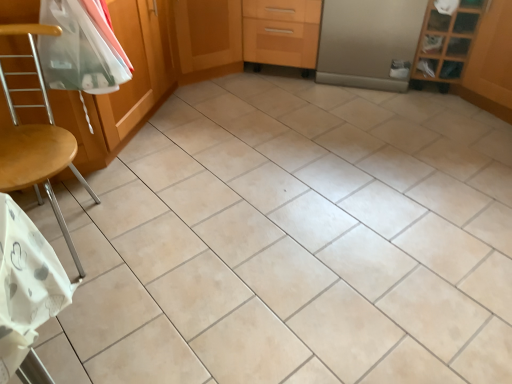
At what (x,y) coordinates should I click in order to perform the action: click on wooden shelf at upper right. Please return your answer as a coordinate pair (x, y). The image size is (512, 384). Looking at the image, I should click on (445, 44).

The image size is (512, 384). Describe the element at coordinates (36, 139) in the screenshot. I see `wooden at left` at that location.

The width and height of the screenshot is (512, 384). I want to click on wooden shelf at upper right, so click(445, 44).

Which of these two, wooden shelf at upper right or wooden cabinet at center, which is the 1th screen door from left to right, is bigger?

With larger size is wooden cabinet at center, which is the 1th screen door from left to right.

Which is nearer, (x=437, y=79) or (x=195, y=12)?

Positioned in front is point (x=195, y=12).

Locate an element on the screen. shelf that appears on the right of wooden cabinet at center, which is the 1th screen door from left to right is located at coordinates (445, 44).

Is wooden shelf at upper right looking in the opposite direction of wooden cabinet at center, which is the 2th screen door from right to left?

No, wooden shelf at upper right is not facing away from wooden cabinet at center, which is the 2th screen door from right to left.

Is wooden cabinet at center, which is the 1th screen door from left to right, positioned before wooden drawer at center?

Yes, wooden cabinet at center, which is the 1th screen door from left to right, is closer to the viewer.

Is wooden cabinet at center, which is the 2th screen door from right to left, with wooden drawer at center?

No, wooden cabinet at center, which is the 2th screen door from right to left, is not touching wooden drawer at center.

From the image's perspective, is wooden cabinet at center, which is the 2th screen door from right to left, located above or below wooden drawer at center?

Clearly, from the image's perspective, wooden cabinet at center, which is the 2th screen door from right to left, is above wooden drawer at center.

Between point (233, 31) and point (250, 39), which one is positioned behind?

The point (250, 39) is behind.

Is wooden cabinet at center, which is the 2th screen door from right to left, not inside satin silver refrigerator at center, which appears as the 2th screen door when viewed from the left?

Absolutely, wooden cabinet at center, which is the 2th screen door from right to left, is external to satin silver refrigerator at center, which appears as the 2th screen door when viewed from the left.

From a real-world perspective, does wooden cabinet at center, which is the 1th screen door from left to right, sit lower than satin silver refrigerator at center, which appears as the 2th screen door when viewed from the left?

Correct, in the physical world, wooden cabinet at center, which is the 1th screen door from left to right, is lower than satin silver refrigerator at center, which appears as the 2th screen door when viewed from the left.

Does point (185, 82) appear closer or farther from the camera than point (399, 15)?

Point (185, 82).

Are wooden cabinet at center, which is the 1th screen door from left to right, and satin silver refrigerator at center, which appears as the 2th screen door when viewed from the left, beside each other?

wooden cabinet at center, which is the 1th screen door from left to right, is not next to satin silver refrigerator at center, which appears as the 2th screen door when viewed from the left, and they're not touching.

Based on the photo, from the image's perspective, is wooden drawer at center located above or below clear plastic bag at upper left?

Clearly, from the image's perspective, wooden drawer at center is above clear plastic bag at upper left.

Is wooden drawer at center not within clear plastic bag at upper left?

Yes.

What's the angular difference between wooden drawer at center and clear plastic bag at upper left's facing directions?

The angle between the facing direction of wooden drawer at center and the facing direction of clear plastic bag at upper left is 90.3 degrees.

Which is behind, wooden drawer at center or clear plastic bag at upper left?

wooden drawer at center is behind.

Considering the sizes of clear plastic bag at upper left and wooden cabinet at center, which is the 2th screen door from right to left, in the image, is clear plastic bag at upper left bigger or smaller than wooden cabinet at center, which is the 2th screen door from right to left,?

Considering their sizes, clear plastic bag at upper left takes up less space than wooden cabinet at center, which is the 2th screen door from right to left.

Does clear plastic bag at upper left turn towards wooden cabinet at center, which is the 2th screen door from right to left?

No, clear plastic bag at upper left is not facing towards wooden cabinet at center, which is the 2th screen door from right to left.

From a real-world perspective, is clear plastic bag at upper left located beneath wooden cabinet at center, which is the 2th screen door from right to left?

Actually, clear plastic bag at upper left is physically above wooden cabinet at center, which is the 2th screen door from right to left, in the real world.

Find the location of a particular element. material located below the wooden cabinet at center, which is the 1th screen door from left to right (from the image's perspective) is located at coordinates (81, 48).

Which object is thinner, clear plastic bag at upper left or satin silver refrigerator at center, which appears as the 2th screen door when viewed from the left?

With smaller width is clear plastic bag at upper left.

Who is taller, clear plastic bag at upper left or satin silver refrigerator at center, the 1th screen door positioned from the right?

satin silver refrigerator at center, the 1th screen door positioned from the right, is taller.

From the image's perspective, is clear plastic bag at upper left beneath satin silver refrigerator at center, the 1th screen door positioned from the right?

Yes, from the image's perspective, clear plastic bag at upper left is beneath satin silver refrigerator at center, the 1th screen door positioned from the right.

Would you say clear plastic bag at upper left contains satin silver refrigerator at center, the 1th screen door positioned from the right?

No, clear plastic bag at upper left does not contain satin silver refrigerator at center, the 1th screen door positioned from the right.

Relative to wooden at left, is wooden cabinet at center, which is the 2th screen door from right to left, in front or behind?

In the image, wooden cabinet at center, which is the 2th screen door from right to left, appears behind wooden at left.

Looking at the image, does wooden cabinet at center, which is the 1th screen door from left to right, seem bigger or smaller compared to wooden at left?

Clearly, wooden cabinet at center, which is the 1th screen door from left to right, is larger in size than wooden at left.

From the image's perspective, is wooden cabinet at center, which is the 2th screen door from right to left, beneath wooden at left?

No, from the image's perspective, wooden cabinet at center, which is the 2th screen door from right to left, is not below wooden at left.

Is wooden cabinet at center, which is the 1th screen door from left to right, not within wooden at left?

Yes, wooden cabinet at center, which is the 1th screen door from left to right, is outside of wooden at left.

Where is `shelf lying in front of the wooden cabinet at center, which is the 1th screen door from left to right`? This screenshot has width=512, height=384. shelf lying in front of the wooden cabinet at center, which is the 1th screen door from left to right is located at coordinates (445, 44).

You are a GUI agent. You are given a task and a screenshot of the screen. Output one action in this format:
    pyautogui.click(x=<x>, y=<y>)
    Task: Click on the screen door above the wooden drawer at center (from the image's perspective)
    The width and height of the screenshot is (512, 384).
    Given the screenshot: What is the action you would take?
    pyautogui.click(x=208, y=38)

Looking at this image, which object lies further to the anchor point satin silver refrigerator at center, which appears as the 2th screen door when viewed from the left, wooden at left or clear plastic bag at upper left?

wooden at left is positioned further to the anchor satin silver refrigerator at center, which appears as the 2th screen door when viewed from the left.

When comparing their distances from wooden at left, does satin silver refrigerator at center, the 1th screen door positioned from the right, or wooden drawer at center seem further?

satin silver refrigerator at center, the 1th screen door positioned from the right, lies further to wooden at left than the other object.

Considering their positions, is wooden drawer at center positioned further to wooden cabinet at center, which is the 1th screen door from left to right, than wooden at left?

wooden at left is further to wooden cabinet at center, which is the 1th screen door from left to right.

Which object lies nearer to the anchor point clear plastic bag at upper left, wooden shelf at upper right or wooden at left?

wooden at left.

Which object lies nearer to the anchor point wooden shelf at upper right, wooden cabinet at center, which is the 1th screen door from left to right, or satin silver refrigerator at center, the 1th screen door positioned from the right?

The object closer to wooden shelf at upper right is satin silver refrigerator at center, the 1th screen door positioned from the right.

Based on the photo, when comparing their distances from wooden at left, does wooden shelf at upper right or wooden cabinet at center, which is the 1th screen door from left to right, seem further?

wooden shelf at upper right is further to wooden at left.

Based on their spatial positions, is clear plastic bag at upper left or wooden cabinet at center, which is the 2th screen door from right to left, closer to wooden at left?

clear plastic bag at upper left is closer to wooden at left.

Estimate the real-world distances between objects in this image. Which object is closer to satin silver refrigerator at center, which appears as the 2th screen door when viewed from the left, clear plastic bag at upper left or wooden at left?

clear plastic bag at upper left lies closer to satin silver refrigerator at center, which appears as the 2th screen door when viewed from the left, than the other object.

At what (x,y) coordinates should I click in order to perform the action: click on material located between wooden at left and wooden cabinet at center, which is the 1th screen door from left to right, in the depth direction. Please return your answer as a coordinate pair (x, y). Looking at the image, I should click on (81, 48).

Locate an element on the screen. material between wooden at left and satin silver refrigerator at center, the 1th screen door positioned from the right, from left to right is located at coordinates (81, 48).

You are a GUI agent. You are given a task and a screenshot of the screen. Output one action in this format:
    pyautogui.click(x=<x>, y=<y>)
    Task: Click on the drawer between clear plastic bag at upper left and satin silver refrigerator at center, the 1th screen door positioned from the right, from left to right
    Image resolution: width=512 pixels, height=384 pixels.
    Given the screenshot: What is the action you would take?
    pyautogui.click(x=281, y=32)

Locate an element on the screen. material between wooden at left and wooden shelf at upper right is located at coordinates (81, 48).